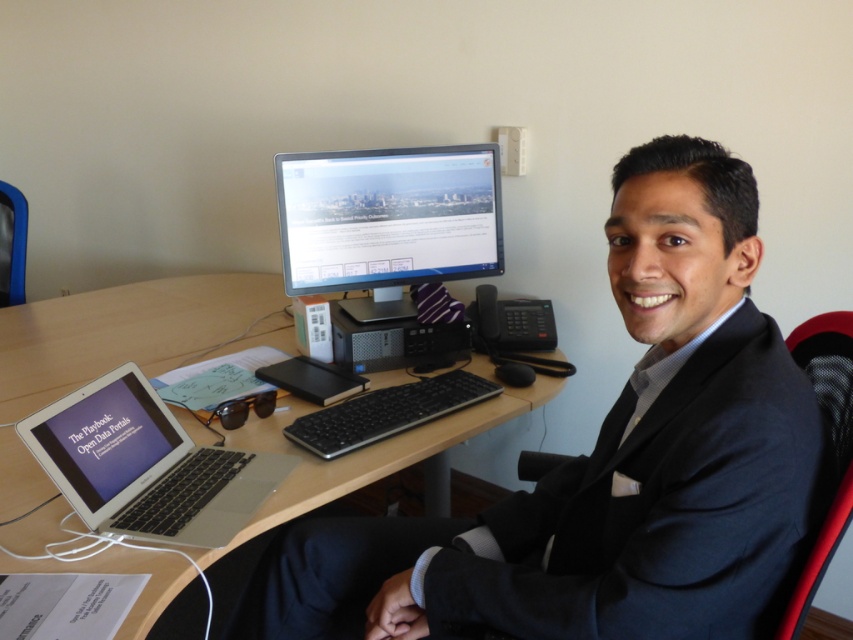
Question: Among these objects, which one is farthest from the camera?

Choices:
 (A) black mesh chair at left
 (B) dark blue suit at center
 (C) wooden at center
 (D) matte black monitor at center

Answer: (A)

Question: Does matte black monitor at center have a smaller size compared to silver/black matte laptop at lower left?

Choices:
 (A) yes
 (B) no

Answer: (B)

Question: Which point is farther to the camera?

Choices:
 (A) silver/black matte laptop at lower left
 (B) black mesh chair at left

Answer: (B)

Question: Does matte black monitor at center have a smaller size compared to black mesh chair at left?

Choices:
 (A) yes
 (B) no

Answer: (B)

Question: Does silver/black matte laptop at lower left have a lesser width compared to black mesh chair at right?

Choices:
 (A) yes
 (B) no

Answer: (B)

Question: Which object is the farthest from the black mesh chair at right?

Choices:
 (A) dark blue suit at center
 (B) matte black monitor at center
 (C) black mesh chair at left
 (D) wooden at center

Answer: (C)